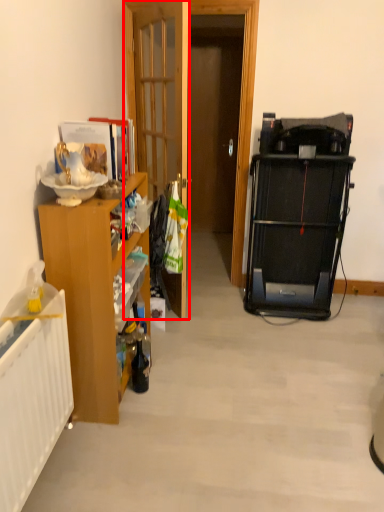
Question: Considering the relative positions of door (annotated by the red box) and cabinetry in the image provided, where is door (annotated by the red box) located with respect to the staircase?

Choices:
 (A) right
 (B) left

Answer: (A)